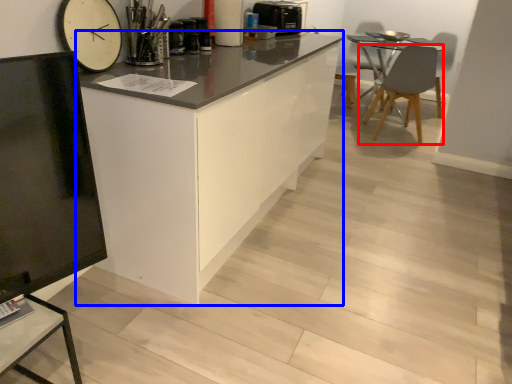
Question: Among these objects, which one is nearest to the camera, chair (highlighted by a red box) or cabinetry (highlighted by a blue box)?

Choices:
 (A) chair
 (B) cabinetry

Answer: (B)